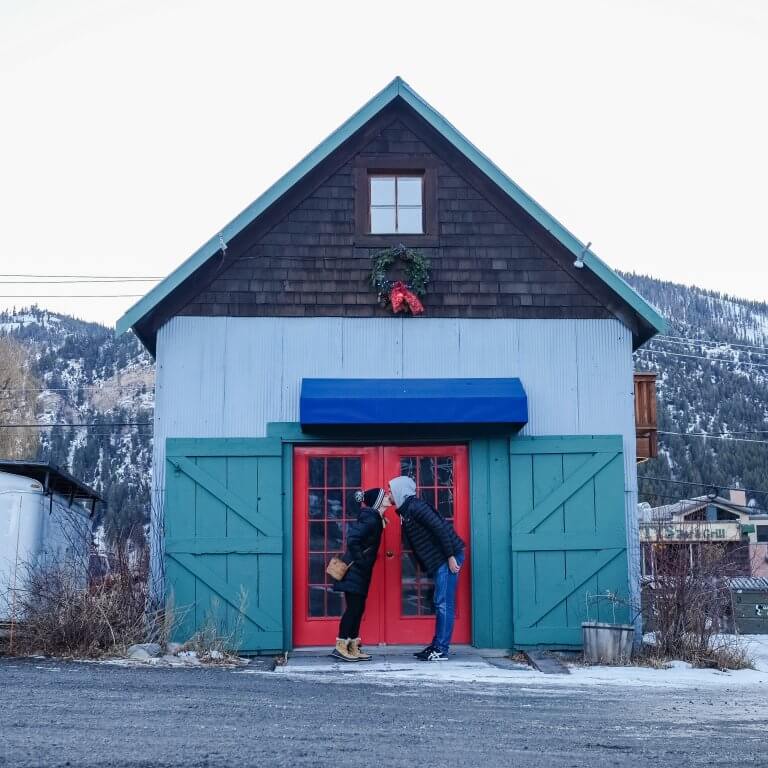
Locate an element on the screen. This screenshot has height=768, width=768. window is located at coordinates (392, 203).